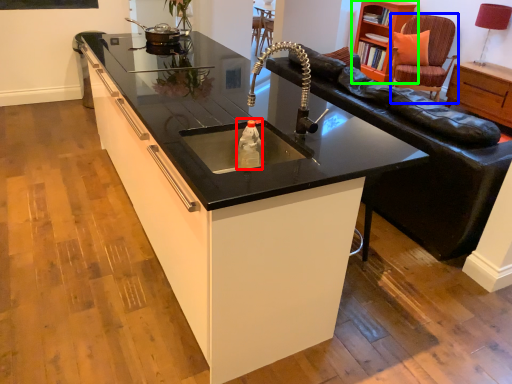
Question: Which is nearer to the bottle (highlighted by a red box)? swivel chair (highlighted by a blue box) or cabinetry (highlighted by a green box).

Choices:
 (A) swivel chair
 (B) cabinetry

Answer: (B)